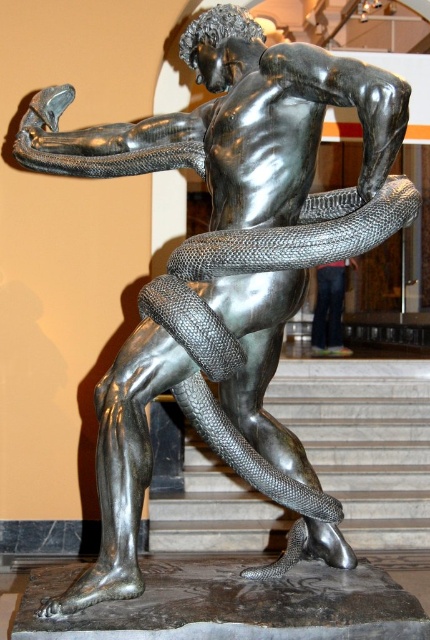
Question: Can you confirm if shiny metallic snake at center is positioned below shiny silver pants at center?

Choices:
 (A) no
 (B) yes

Answer: (B)

Question: Which point is closer to the camera taking this photo?

Choices:
 (A) (240, 472)
 (B) (322, 278)

Answer: (A)

Question: In this image, where is shiny metallic snake at center located relative to shiny silver pants at center?

Choices:
 (A) above
 (B) below

Answer: (B)

Question: Is shiny metallic snake at center positioned before shiny silver pants at center?

Choices:
 (A) yes
 (B) no

Answer: (A)

Question: Which point appears farthest from the camera in this image?

Choices:
 (A) (326, 330)
 (B) (218, 349)

Answer: (A)